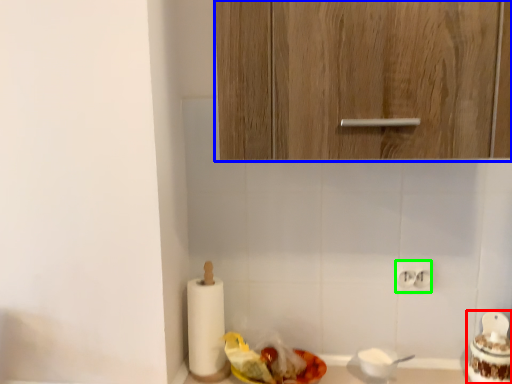
Question: Considering the real-world distances, which object is farthest from food (highlighted by a red box)? cabinetry (highlighted by a blue box) or electric outlet (highlighted by a green box)?

Choices:
 (A) cabinetry
 (B) electric outlet

Answer: (A)